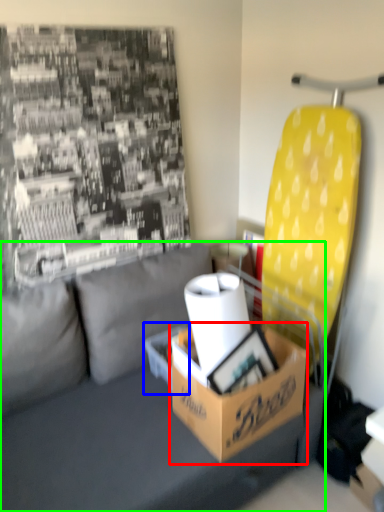
Question: Considering the real-world distances, which object is farthest from box (highlighted by a red box)? cardboard box (highlighted by a blue box) or studio couch (highlighted by a green box)?

Choices:
 (A) cardboard box
 (B) studio couch

Answer: (A)